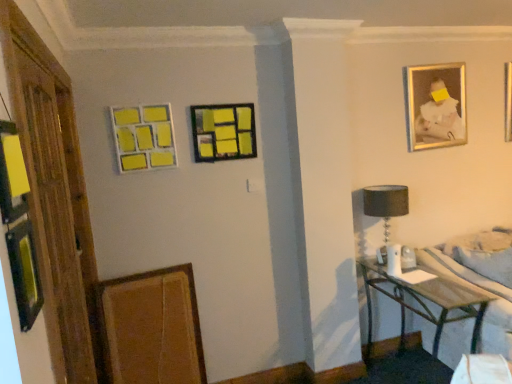
Where is `gold-framed photo at upper right, the fourth picture frame in the bottom-to-top sequence`? The width and height of the screenshot is (512, 384). gold-framed photo at upper right, the fourth picture frame in the bottom-to-top sequence is located at coordinates (436, 106).

The image size is (512, 384). What do you see at coordinates (386, 207) in the screenshot?
I see `black fabric lampshade at right` at bounding box center [386, 207].

This screenshot has height=384, width=512. Identify the location of yellow matte picture frame at upper left, which is the 1th picture frame in left-to-right order. (143, 137).

This screenshot has height=384, width=512. Find the location of `matte black picture frame at center, which appears as the third picture frame when viewed from the left`. matte black picture frame at center, which appears as the third picture frame when viewed from the left is located at coordinates (223, 132).

How much space does matte black picture frame at center, which appears as the third picture frame when viewed from the left, occupy horizontally?

It is 2.26 inches.

This screenshot has width=512, height=384. Identify the location of gold-framed photo at upper right, the fourth picture frame in the bottom-to-top sequence. (436, 106).

Does point (374, 265) appear closer or farther from the camera than point (203, 153)?

Point (374, 265) appears to be farther away from the viewer than point (203, 153).

Considering the sizes of objects metallic silver table at lower right and matte black picture frame at center, arranged as the 2th picture frame when viewed from the right, in the image provided, who is shorter, metallic silver table at lower right or matte black picture frame at center, arranged as the 2th picture frame when viewed from the right,?

Standing shorter between the two is matte black picture frame at center, arranged as the 2th picture frame when viewed from the right.

This screenshot has width=512, height=384. Find the location of `the 3rd picture frame behind the metallic silver table at lower right, counting from the anchor's position`. the 3rd picture frame behind the metallic silver table at lower right, counting from the anchor's position is located at coordinates pyautogui.click(x=223, y=132).

Is yellow matte picture frame at upper left, which is the 1th picture frame in left-to-right order, not inside wooden bed frame at lower right?

yellow matte picture frame at upper left, which is the 1th picture frame in left-to-right order, is positioned outside wooden bed frame at lower right.

Considering the sizes of objects yellow matte picture frame at upper left, which is the fourth picture frame in right-to-left order, and wooden bed frame at lower right in the image provided, who is bigger, yellow matte picture frame at upper left, which is the fourth picture frame in right-to-left order, or wooden bed frame at lower right?

wooden bed frame at lower right.

Identify the location of the 1st picture frame above the wooden bed frame at lower right (from the image's perspective). (143, 137).

Considering the relative sizes of yellow matte picture frame at upper left, which is the fourth picture frame in right-to-left order, and wooden bed frame at lower right in the image provided, is yellow matte picture frame at upper left, which is the fourth picture frame in right-to-left order, taller than wooden bed frame at lower right?

Incorrect, the height of yellow matte picture frame at upper left, which is the fourth picture frame in right-to-left order, is not larger of that of wooden bed frame at lower right.

How many degrees apart are the facing directions of black fabric lampshade at right and transparent glass door at left?

The angular difference between black fabric lampshade at right and transparent glass door at left is 88.7 degrees.

Is transparent glass door at left at the back of black fabric lampshade at right?

No, transparent glass door at left is not at the back of black fabric lampshade at right.

Is transparent glass door at left inside black fabric lampshade at right?

Actually, transparent glass door at left is outside black fabric lampshade at right.

Between black fabric lampshade at right and transparent glass door at left, which one has smaller width?

transparent glass door at left.

Is metallic silver table at lower right far away from wooden textured picture frame at lower left, acting as the 3th picture frame starting from the right?

metallic silver table at lower right is positioned a significant distance from wooden textured picture frame at lower left, acting as the 3th picture frame starting from the right.

From a real-world perspective, is metallic silver table at lower right located beneath wooden textured picture frame at lower left, acting as the 3th picture frame starting from the right?

Indeed, from a real-world perspective, metallic silver table at lower right is positioned beneath wooden textured picture frame at lower left, acting as the 3th picture frame starting from the right.

Does point (402, 298) lie in front of point (120, 287)?

That is False.

Considering the relative positions of metallic silver table at lower right and wooden bed frame at lower right in the image provided, is metallic silver table at lower right to the right of wooden bed frame at lower right from the viewer's perspective?

No.

Is metallic silver table at lower right wider than wooden bed frame at lower right?

Yes.

Is metallic silver table at lower right not near wooden bed frame at lower right?

That's not correct — metallic silver table at lower right is a little close to wooden bed frame at lower right.

How many degrees apart are the facing directions of metallic silver table at lower right and wooden bed frame at lower right?

The angular difference between metallic silver table at lower right and wooden bed frame at lower right is 88.3 degrees.

Is wooden textured picture frame at lower left, acting as the 3th picture frame starting from the right, bigger than transparent glass door at left?

Actually, wooden textured picture frame at lower left, acting as the 3th picture frame starting from the right, might be smaller than transparent glass door at left.

Is wooden textured picture frame at lower left, the 4th picture frame when ordered from top to bottom, positioned with its back to transparent glass door at left?

wooden textured picture frame at lower left, the 4th picture frame when ordered from top to bottom, does not have its back to transparent glass door at left.

Considering the relative positions of wooden textured picture frame at lower left, the 4th picture frame when ordered from top to bottom, and transparent glass door at left in the image provided, is wooden textured picture frame at lower left, the 4th picture frame when ordered from top to bottom, to the right of transparent glass door at left from the viewer's perspective?

Yes.

From a real-world perspective, which is physically above, wooden textured picture frame at lower left, positioned as the second picture frame in left-to-right order, or transparent glass door at left?

From a 3D spatial view, transparent glass door at left is above.

Considering the sizes of objects yellow matte picture frame at upper left, which is the fourth picture frame in right-to-left order, and black fabric lampshade at right in the image provided, who is smaller, yellow matte picture frame at upper left, which is the fourth picture frame in right-to-left order, or black fabric lampshade at right?

yellow matte picture frame at upper left, which is the fourth picture frame in right-to-left order.

From the image's perspective, does yellow matte picture frame at upper left, which is the fourth picture frame in right-to-left order, appear lower than black fabric lampshade at right?

No, from the image's perspective, yellow matte picture frame at upper left, which is the fourth picture frame in right-to-left order, is not beneath black fabric lampshade at right.

The height and width of the screenshot is (384, 512). What are the coordinates of `the 3rd picture frame counting from the left side of the black fabric lampshade at right` in the screenshot? It's located at (143, 137).

From a real-world perspective, starting from the metallic silver table at lower right, which picture frame is the 2nd one vertically above it? Please provide its 2D coordinates.

[(223, 132)]

The image size is (512, 384). I want to click on the 4th picture frame counting from the left side of the wooden bed frame at lower right, so click(x=143, y=137).

Considering their positions, is wooden bed frame at lower right positioned closer to wooden textured picture frame at lower left, positioned as the second picture frame in left-to-right order, than yellow matte picture frame at upper left, which is the 2th picture frame from bottom to top?

yellow matte picture frame at upper left, which is the 2th picture frame from bottom to top, lies closer to wooden textured picture frame at lower left, positioned as the second picture frame in left-to-right order, than the other object.

Based on their spatial positions, is transparent glass door at left or metallic silver table at lower right further from wooden textured picture frame at lower left, the first picture frame from the bottom?

metallic silver table at lower right.

Considering their positions, is transparent glass door at left positioned further to gold-framed photo at upper right, which appears as the 1th picture frame when viewed from the top, than wooden textured picture frame at lower left, the 4th picture frame when ordered from top to bottom?

transparent glass door at left lies further to gold-framed photo at upper right, which appears as the 1th picture frame when viewed from the top, than the other object.

From the image, which object appears to be nearer to wooden textured picture frame at lower left, the first picture frame from the bottom, black fabric lampshade at right or matte black picture frame at center, the 3th picture frame ordered from the bottom?

matte black picture frame at center, the 3th picture frame ordered from the bottom.

Estimate the real-world distances between objects in this image. Which object is further from gold-framed photo at upper right, the fourth picture frame in the bottom-to-top sequence, wooden textured picture frame at lower left, the 4th picture frame when ordered from top to bottom, or wooden bed frame at lower right?

wooden textured picture frame at lower left, the 4th picture frame when ordered from top to bottom, lies further to gold-framed photo at upper right, the fourth picture frame in the bottom-to-top sequence, than the other object.

Looking at the image, which one is located further to black fabric lampshade at right, metallic silver table at lower right or matte black picture frame at center, arranged as the 2th picture frame when viewed from the right?

matte black picture frame at center, arranged as the 2th picture frame when viewed from the right, is further to black fabric lampshade at right.

When comparing their distances from wooden bed frame at lower right, does transparent glass door at left or yellow matte picture frame at upper left, which is the 2th picture frame from bottom to top, seem further?

Based on the image, transparent glass door at left appears to be further to wooden bed frame at lower right.

Estimate the real-world distances between objects in this image. Which object is closer to wooden bed frame at lower right, transparent glass door at left or black fabric lampshade at right?

black fabric lampshade at right is positioned closer to the anchor wooden bed frame at lower right.

The image size is (512, 384). I want to click on table lamp located between transparent glass door at left and wooden bed frame at lower right in the left-right direction, so click(386, 207).

Locate an element on the screen. This screenshot has width=512, height=384. table located between matte black picture frame at center, which appears as the third picture frame when viewed from the left, and wooden bed frame at lower right in the left-right direction is located at coordinates (425, 302).

At what (x,y) coordinates should I click in order to perform the action: click on bed frame between gold-framed photo at upper right, positioned as the 1th picture frame in right-to-left order, and metallic silver table at lower right vertically. Please return your answer as a coordinate pair (x, y). The height and width of the screenshot is (384, 512). Looking at the image, I should click on (480, 279).

Where is `table between wooden textured picture frame at lower left, the 4th picture frame when ordered from top to bottom, and wooden bed frame at lower right from left to right`? This screenshot has height=384, width=512. table between wooden textured picture frame at lower left, the 4th picture frame when ordered from top to bottom, and wooden bed frame at lower right from left to right is located at coordinates (425, 302).